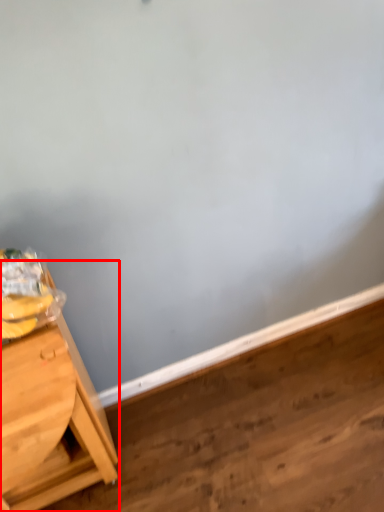
Question: In this image, where is table (annotated by the red box) located relative to plywood?

Choices:
 (A) right
 (B) left

Answer: (B)